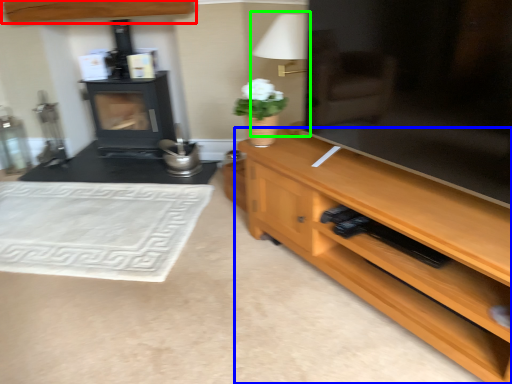
Question: Considering the real-world distances, which object is farthest from cabinetry (highlighted by a red box)? desk (highlighted by a blue box) or table lamp (highlighted by a green box)?

Choices:
 (A) desk
 (B) table lamp

Answer: (A)